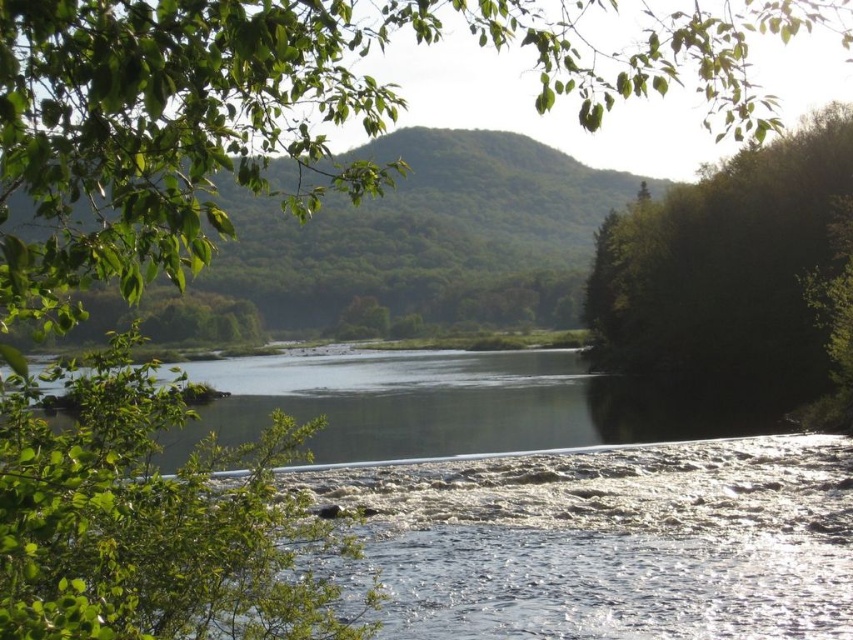
Question: Which point appears closest to the camera in this image?

Choices:
 (A) (776, 148)
 (B) (675, 76)

Answer: (B)

Question: Where is green leafy tree at upper left located in relation to green leafy tree at right in the image?

Choices:
 (A) below
 (B) above

Answer: (B)

Question: Does green leafy tree at upper left appear on the right side of green leafy tree at right?

Choices:
 (A) no
 (B) yes

Answer: (A)

Question: Does green leafy tree at upper left appear under green leafy tree at right?

Choices:
 (A) yes
 (B) no

Answer: (B)